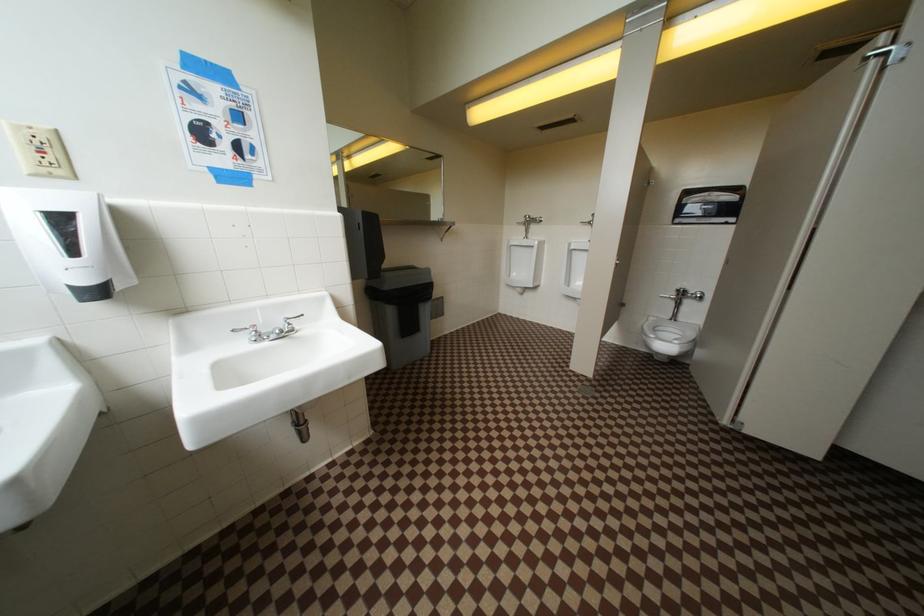
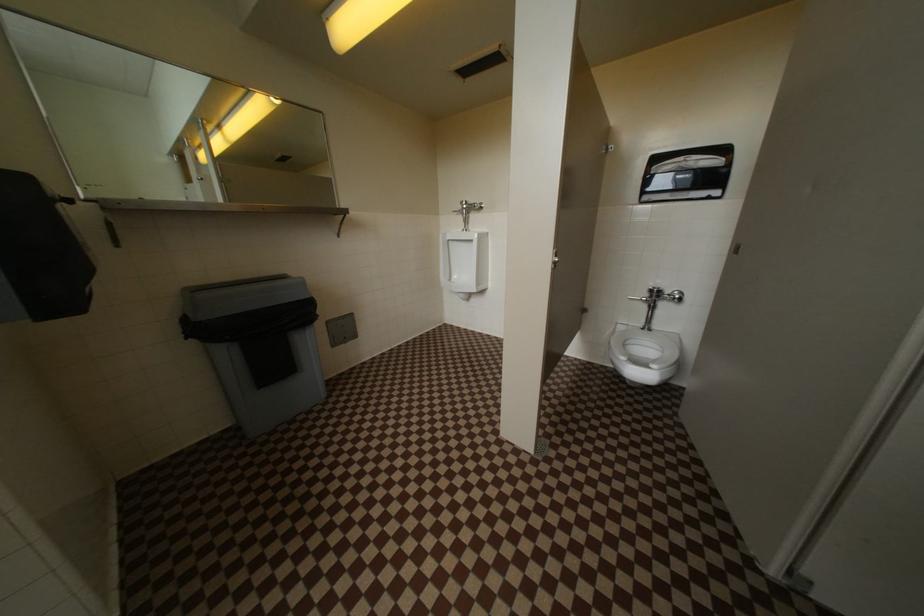
Which direction would the cameraman need to move to produce the second image?

The movement direction of the cameraman is right, forward.